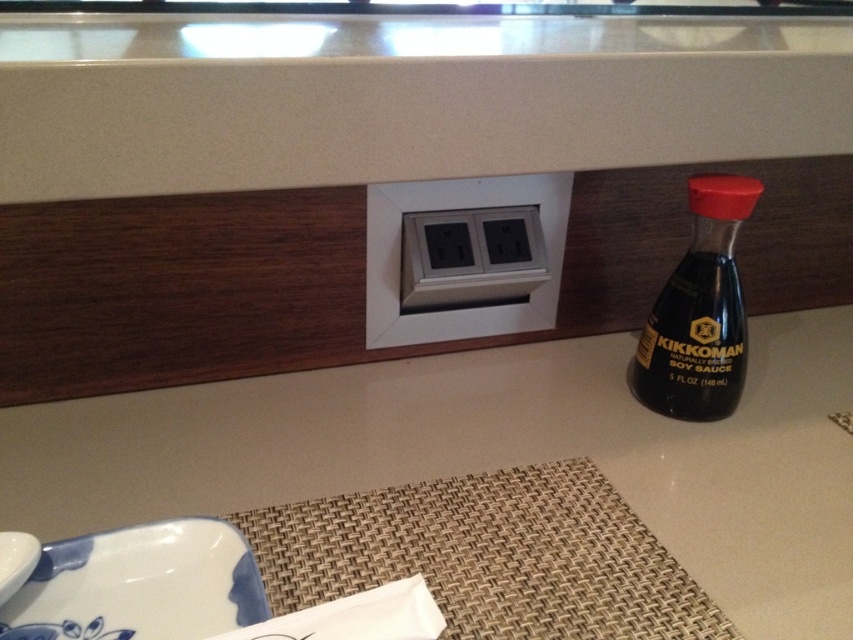
You are arranging items on the white matte counter top at center and the white plastic electrical outlet at center. Which surface is more accessible for placing a small bowl?

The white matte counter top at center is closer to the viewer than the white plastic electrical outlet at center, so it is more accessible for placing a small bowl.

You are a chef preparing a dish and need to place the blue glossy plate at lower left on the kitchen counter. Where exactly should you place it?

You should place the blue glossy plate at lower left at the coordinate point of (140,584) on the kitchen counter.

You are standing in front of the kitchen countertop with the electrical outlet and the Kikkoman soy sauce bottle. There are two points marked on the countertop at coordinates point (517, 545) and point (395, 257). Which point is closer to you?

Point (517, 545) is in front of point (395, 257), so it is closer to you.